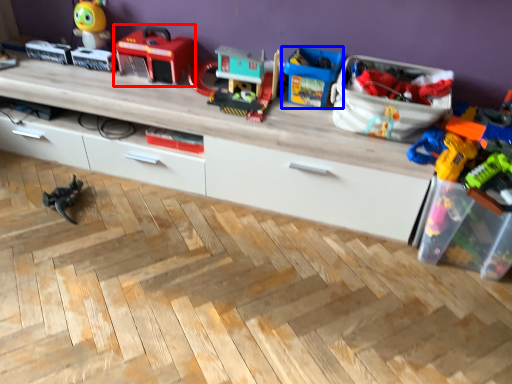
Question: Which object appears farthest to the camera in this image, toy (highlighted by a red box) or toy (highlighted by a blue box)?

Choices:
 (A) toy
 (B) toy

Answer: (A)